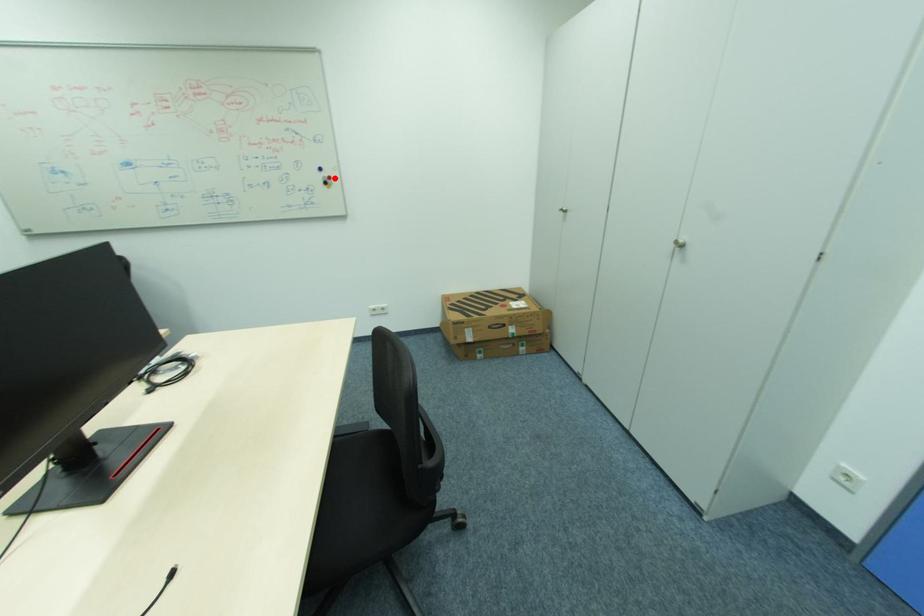
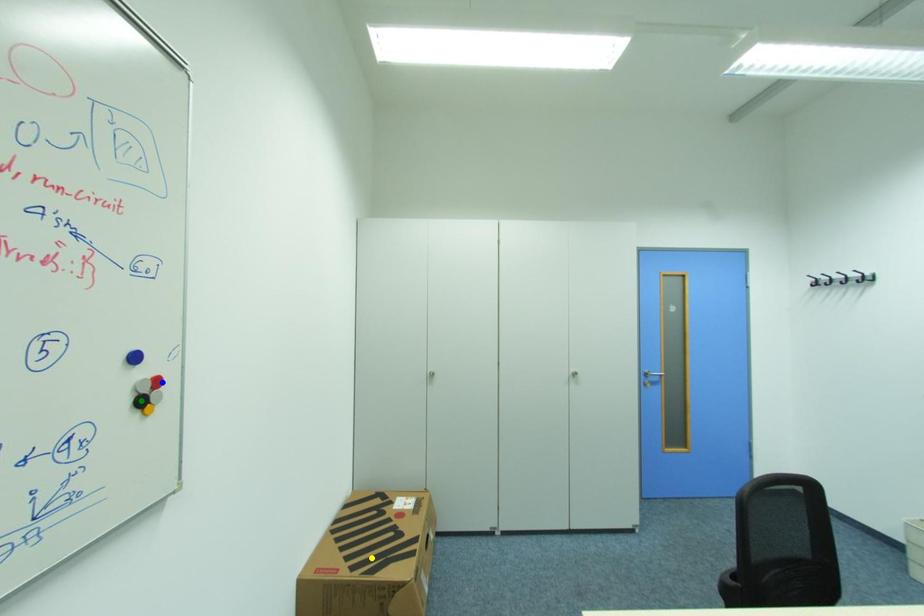
Question: I am providing you with two images of the same scene from different viewpoints. A red point is marked on the first image. You are given multiple points on the second image. Can you choose the point in image 2 that corresponds to the point in image 1?

Choices:
 (A) yellow point
 (B) blue point
 (C) green point

Answer: (B)